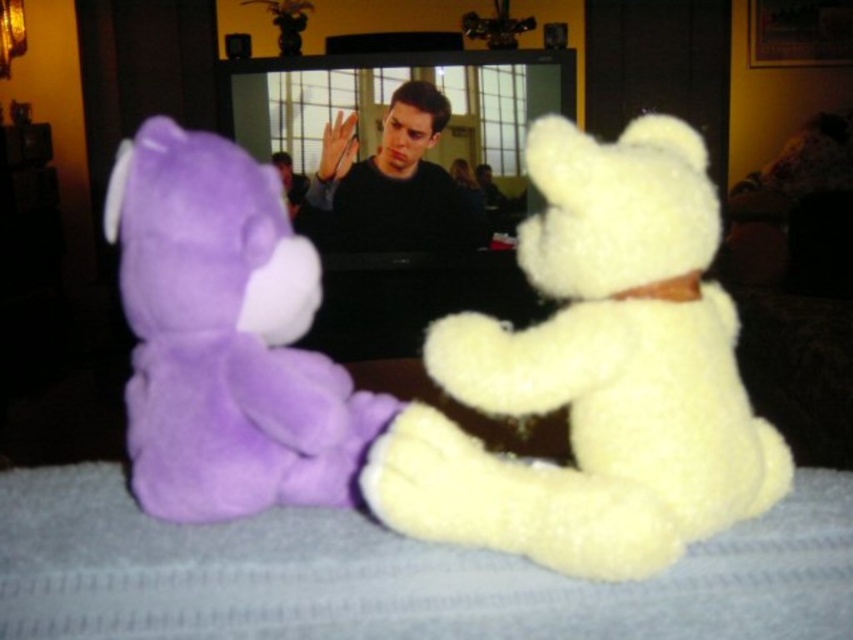
You are organizing a closet and see the matte black sweater at center and the matte black shirt at center. Which item is located higher up?

The matte black sweater at center is located higher up than the matte black shirt at center.

You are organizing a toy store shelf and need to arrange the purple plush bear at left and the matte black sweater at center. Given their heights, which one should you place on the lower shelf to ensure proper display?

The purple plush bear at left is not as tall as the matte black sweater at center, so it should be placed on the lower shelf to accommodate the taller sweater above it.

You are organizing a toy shelf and need to place the white fluffy teddy bear at center and the matte black shirt at center. Since the shelf has limited vertical space, which object should you place first to ensure both fit properly?

The white fluffy teddy bear at center is taller than the matte black shirt at center, so you should place the white fluffy teddy bear at center first to accommodate its height, then place the matte black shirt at center below it.